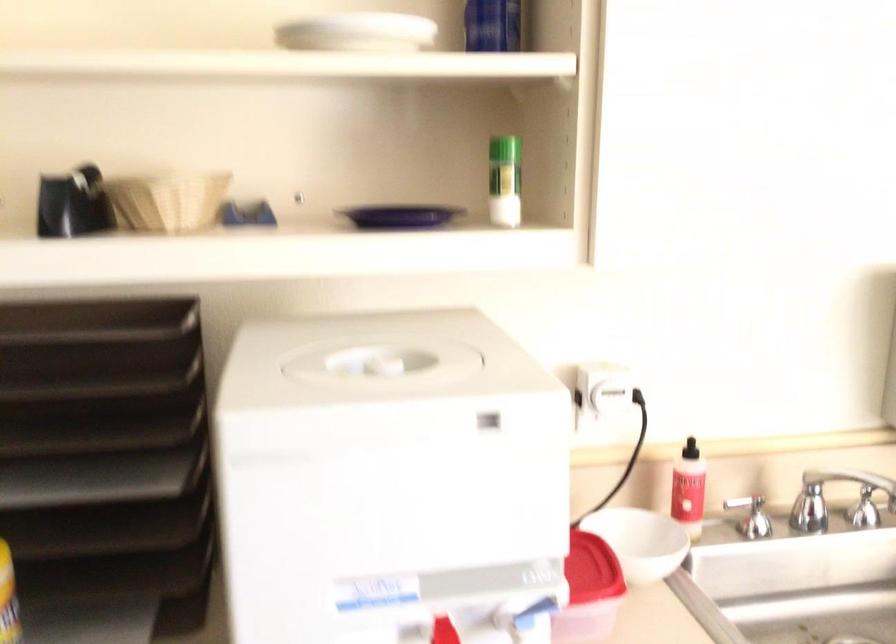
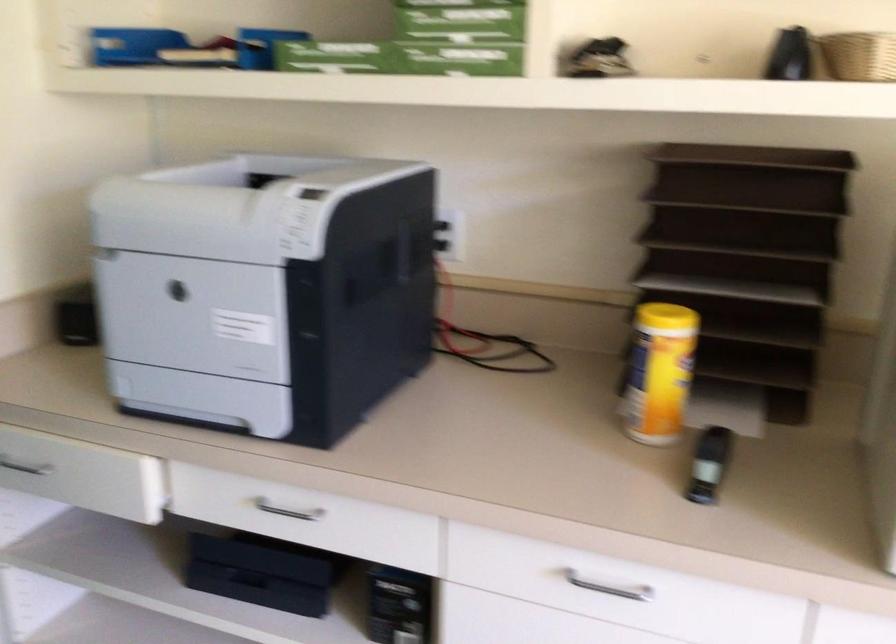
In the second image, find the point that corresponds to pixel 149 212 in the first image.

(858, 55)